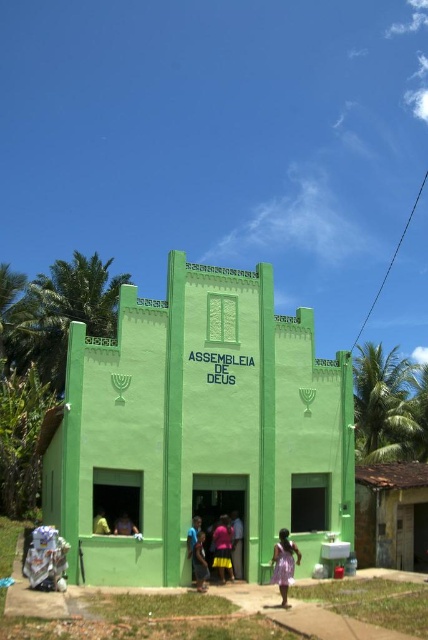
You are a photographer standing in front of the green building with the blue lettering. You notice a blue fabric shirt at center and a yellow fabric at lower left in your viewfinder. Which object appears taller in the photo?

The blue fabric shirt at center appears taller than the yellow fabric at lower left because it has a greater height compared to it according to the description.

You are a photographer standing in front of the green building with the words ASSEMBLEIA DE DEUS. You notice two fabrics in the scene. Which fabric is narrower between the blue fabric shirt at center and the yellow fabric at lower left?

The blue fabric shirt at center has a lesser width compared to the yellow fabric at lower left, so the blue fabric shirt at center is narrower.